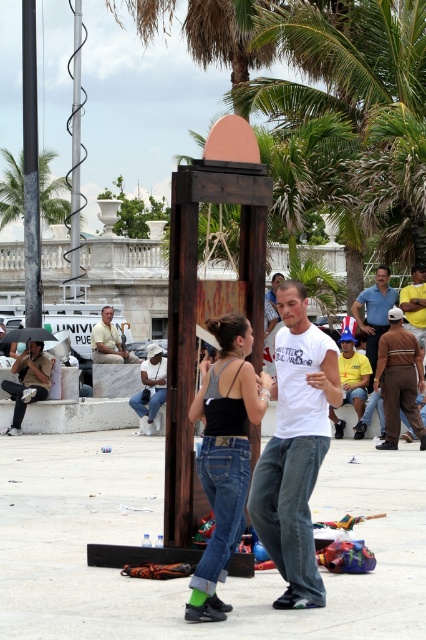
Does smooth black pole at left have a lesser width compared to green leafy palm tree at upper left?

Indeed, smooth black pole at left has a lesser width compared to green leafy palm tree at upper left.

Consider the image. Does smooth black pole at left have a smaller size compared to green leafy palm tree at upper left?

Yes.

Does point (23, 108) lie in front of point (2, 216)?

Yes, point (23, 108) is closer to viewer.

Identify the location of smooth black pole at left. (31, 168).

Between brown leather jacket at lower right and blue denim jeans at center, which one has more height?

With more height is brown leather jacket at lower right.

Is point (402, 358) more distant than point (383, 276)?

No, it is in front of (383, 276).

This screenshot has width=426, height=640. What are the coordinates of `brown leather jacket at lower right` in the screenshot? It's located at (399, 380).

Between denim jeans at center and blue denim jeans at center, which one has less height?

blue denim jeans at center is shorter.

Identify the location of denim jeans at center. click(x=224, y=454).